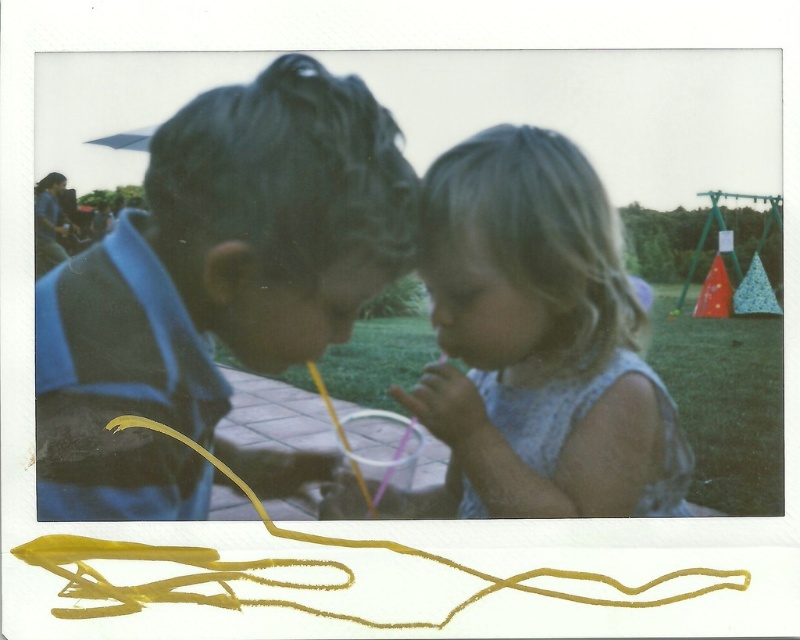
Is blue striped shirt at left smaller than light blue fabric dress at center?

Actually, blue striped shirt at left might be larger than light blue fabric dress at center.

Which is behind, point (180, 237) or point (516, 150)?

Point (516, 150)

Locate an element on the screen. blue striped shirt at left is located at coordinates (214, 282).